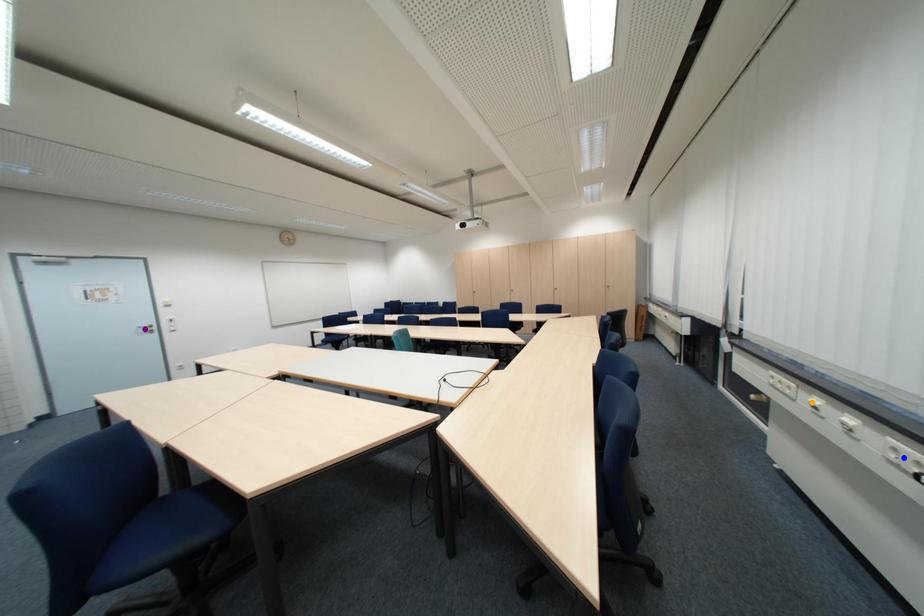
Order these from nearest to farthest:
1. blue point
2. purple point
3. orange point

purple point → orange point → blue point